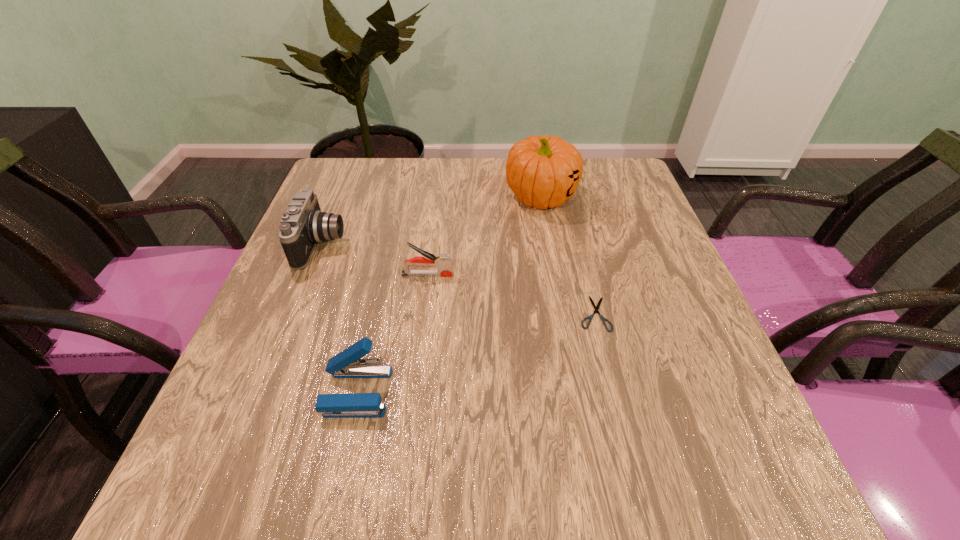
Where is `vacant area situated 0.200m on the handle side of the farther stapler`? This screenshot has width=960, height=540. vacant area situated 0.200m on the handle side of the farther stapler is located at coordinates (542, 274).

At what (x,y) coordinates should I click in order to perform the action: click on free space located 0.290m on the back of the nearer stapler. Please return your answer as a coordinate pair (x, y). The width and height of the screenshot is (960, 540). Looking at the image, I should click on (387, 260).

Locate an element on the screen. The image size is (960, 540). free spot located 0.160m on the right of the shears is located at coordinates (688, 313).

Find the location of a particular element. This screenshot has height=540, width=960. object positioned at the far edge is located at coordinates (544, 171).

Where is `object that is at the left edge`? The height and width of the screenshot is (540, 960). object that is at the left edge is located at coordinates (303, 225).

Locate an element on the screen. vacant space at the far edge of the desktop is located at coordinates (498, 184).

This screenshot has width=960, height=540. What are the coordinates of `free space at the near edge` in the screenshot? It's located at (494, 479).

In the image, there is a desktop. Where is `vacant space at the left edge`? vacant space at the left edge is located at coordinates (253, 345).

In order to click on blank space at the right edge in this screenshot , I will do `click(672, 361)`.

Where is `vacant space at the far right corner of the desktop`? This screenshot has height=540, width=960. vacant space at the far right corner of the desktop is located at coordinates (624, 170).